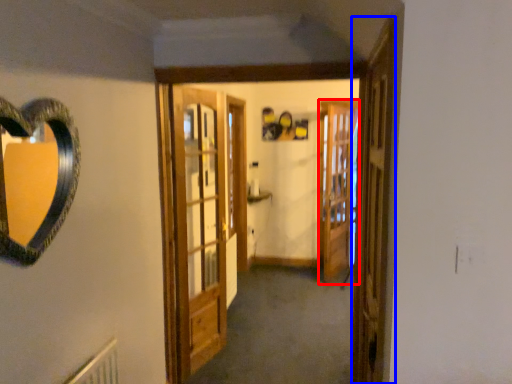
Question: Which object appears closest to the camera in this image, screen door (highlighted by a red box) or screen door (highlighted by a blue box)?

Choices:
 (A) screen door
 (B) screen door

Answer: (B)